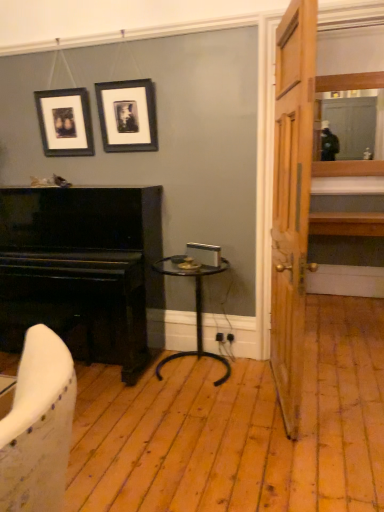
What do you see at coordinates (65, 122) in the screenshot? Image resolution: width=384 pixels, height=512 pixels. I see `matte black picture frame at upper left, the second picture frame from the right` at bounding box center [65, 122].

The height and width of the screenshot is (512, 384). I want to click on black metal side table at center, so click(x=196, y=307).

What is the approximate width of black polished piano at left?

The width of black polished piano at left is 25.55 inches.

The width and height of the screenshot is (384, 512). What do you see at coordinates (81, 270) in the screenshot?
I see `black polished piano at left` at bounding box center [81, 270].

What do you see at coordinates (127, 115) in the screenshot? The height and width of the screenshot is (512, 384). I see `black matte picture frame at upper center, which ranks as the 1th picture frame in right-to-left order` at bounding box center [127, 115].

Locate an element on the screen. wooden door at right is located at coordinates (291, 201).

Is wooden door at right with black matte picture frame at upper center, which is counted as the 2th picture frame, starting from the left?

wooden door at right and black matte picture frame at upper center, which is counted as the 2th picture frame, starting from the left, are clearly separated.

Based on the photo, could you tell me if wooden door at right is turned towards black matte picture frame at upper center, which is counted as the 2th picture frame, starting from the left?

No, wooden door at right is not oriented towards black matte picture frame at upper center, which is counted as the 2th picture frame, starting from the left.

From the image's perspective, which object appears higher, wooden door at right or black matte picture frame at upper center, which ranks as the 1th picture frame in right-to-left order?

black matte picture frame at upper center, which ranks as the 1th picture frame in right-to-left order.

Do you think wooden door at right is within black matte picture frame at upper center, which ranks as the 1th picture frame in right-to-left order, or outside of it?

wooden door at right exists outside the volume of black matte picture frame at upper center, which ranks as the 1th picture frame in right-to-left order.

From their relative heights in the image, would you say wooden door at right is taller or shorter than matte black picture frame at upper left, the second picture frame from the right?

In the image, wooden door at right appears to be taller than matte black picture frame at upper left, the second picture frame from the right.

Could matte black picture frame at upper left, the second picture frame from the right, be considered to be inside wooden door at right?

That's incorrect, matte black picture frame at upper left, the second picture frame from the right, is not inside wooden door at right.

From the image's perspective, which one is positioned higher, wooden door at right or matte black picture frame at upper left, which is the first picture frame in left-to-right order?

→ matte black picture frame at upper left, which is the first picture frame in left-to-right order.

From the image's perspective, would you say black polished piano at left is positioned over black matte picture frame at upper center, which ranks as the 1th picture frame in right-to-left order?

No.

Does black polished piano at left appear on the right side of black matte picture frame at upper center, which is counted as the 2th picture frame, starting from the left?

Incorrect, black polished piano at left is not on the right side of black matte picture frame at upper center, which is counted as the 2th picture frame, starting from the left.

Consider the image. Is black polished piano at left facing towards black matte picture frame at upper center, which is counted as the 2th picture frame, starting from the left?

No, black polished piano at left is not oriented towards black matte picture frame at upper center, which is counted as the 2th picture frame, starting from the left.

What are the coordinates of `piano on the left of matte black picture frame at upper left, which is the first picture frame in left-to-right order` in the screenshot? It's located at (81, 270).

Is black polished piano at left oriented away from matte black picture frame at upper left, which is the first picture frame in left-to-right order?

No, black polished piano at left's orientation is not away from matte black picture frame at upper left, which is the first picture frame in left-to-right order.

How much distance is there between black polished piano at left and matte black picture frame at upper left, the second picture frame from the right?

black polished piano at left is 76.75 centimeters from matte black picture frame at upper left, the second picture frame from the right.

Looking at the image, does matte black picture frame at upper left, the second picture frame from the right, seem bigger or smaller compared to black matte picture frame at upper center, which ranks as the 1th picture frame in right-to-left order?

Clearly, matte black picture frame at upper left, the second picture frame from the right, is smaller in size than black matte picture frame at upper center, which ranks as the 1th picture frame in right-to-left order.

Is point (73, 156) positioned before point (112, 127)?

No, it is not.

From a real-world perspective, which is physically below, matte black picture frame at upper left, the second picture frame from the right, or black matte picture frame at upper center, which is counted as the 2th picture frame, starting from the left?

matte black picture frame at upper left, the second picture frame from the right.

Locate an element on the screen. picture frame above the matte black picture frame at upper left, which is the first picture frame in left-to-right order (from the image's perspective) is located at coordinates (127, 115).

From a real-world perspective, is wooden door at right beneath black polished piano at left?

No, from a real-world perspective, wooden door at right is not beneath black polished piano at left.

Identify the location of door lying above the black polished piano at left (from the image's perspective). (291, 201).

Is wooden door at right aimed at black polished piano at left?

No, wooden door at right does not turn towards black polished piano at left.

Is wooden door at right placed right next to black polished piano at left?

wooden door at right and black polished piano at left are clearly separated.

Which of these two, matte black picture frame at upper left, which is the first picture frame in left-to-right order, or black polished piano at left, is smaller?

With smaller size is matte black picture frame at upper left, which is the first picture frame in left-to-right order.

How many degrees apart are the facing directions of matte black picture frame at upper left, which is the first picture frame in left-to-right order, and black polished piano at left?

They differ by 0.281 degrees in their facing directions.

Would you say matte black picture frame at upper left, the second picture frame from the right, is to the left or to the right of black polished piano at left in the picture?

Based on their positions, matte black picture frame at upper left, the second picture frame from the right, is located to the right of black polished piano at left.

Consider the image. From the image's perspective, which object appears higher, matte black picture frame at upper left, the second picture frame from the right, or black polished piano at left?

matte black picture frame at upper left, the second picture frame from the right, from the image's perspective.

Which picture frame is the 1st one when counting from the left side of the wooden door at right? Please provide its 2D coordinates.

[(127, 115)]

This screenshot has width=384, height=512. Identify the location of door that appears below the matte black picture frame at upper left, the second picture frame from the right (from a real-world perspective). (291, 201).

Looking at the image, which one is located further to wooden door at right, black matte picture frame at upper center, which is counted as the 2th picture frame, starting from the left, or black polished piano at left?

Based on the image, black polished piano at left appears to be further to wooden door at right.

Which object lies nearer to the anchor point black polished piano at left, black matte picture frame at upper center, which is counted as the 2th picture frame, starting from the left, or matte black picture frame at upper left, which is the first picture frame in left-to-right order?

black matte picture frame at upper center, which is counted as the 2th picture frame, starting from the left, is closer to black polished piano at left.

From the image, which object appears to be nearer to black polished piano at left, matte black picture frame at upper left, the second picture frame from the right, or black matte picture frame at upper center, which is counted as the 2th picture frame, starting from the left?

black matte picture frame at upper center, which is counted as the 2th picture frame, starting from the left, is closer to black polished piano at left.

Estimate the real-world distances between objects in this image. Which object is closer to black metal side table at center, black matte picture frame at upper center, which ranks as the 1th picture frame in right-to-left order, or wooden door at right?

Among the two, wooden door at right is located nearer to black metal side table at center.

Looking at the image, which one is located further to black polished piano at left, black metal side table at center or wooden door at right?

wooden door at right.

Which object lies nearer to the anchor point black matte picture frame at upper center, which is counted as the 2th picture frame, starting from the left, black metal side table at center or black polished piano at left?

black polished piano at left.

Based on their spatial positions, is black polished piano at left or black matte picture frame at upper center, which is counted as the 2th picture frame, starting from the left, closer to wooden door at right?

Based on the image, black matte picture frame at upper center, which is counted as the 2th picture frame, starting from the left, appears to be nearer to wooden door at right.

Which object lies nearer to the anchor point wooden door at right, black metal side table at center or black polished piano at left?

The object closer to wooden door at right is black metal side table at center.

Identify the location of picture frame between black matte picture frame at upper center, which ranks as the 1th picture frame in right-to-left order, and black polished piano at left vertically. (65, 122).

The height and width of the screenshot is (512, 384). In order to click on picture frame situated between matte black picture frame at upper left, which is the first picture frame in left-to-right order, and wooden door at right from left to right in this screenshot , I will do `click(127, 115)`.

In order to click on piano that lies between black matte picture frame at upper center, which is counted as the 2th picture frame, starting from the left, and black metal side table at center from top to bottom in this screenshot , I will do `click(81, 270)`.

Find the location of a particular element. The height and width of the screenshot is (512, 384). door between black matte picture frame at upper center, which ranks as the 1th picture frame in right-to-left order, and black metal side table at center, in the vertical direction is located at coordinates (291, 201).